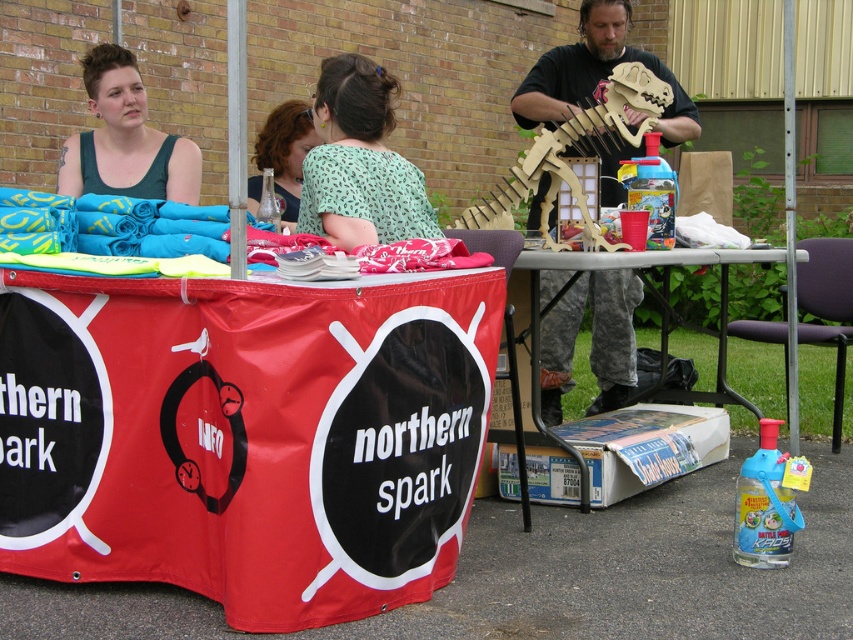
From the picture: You are setting up a booth at an outdoor market and need to place a narrow item between the wooden dinosaur skeleton at right and the metallic silver table at center. Which object should you place it next to to ensure it fits?

The wooden dinosaur skeleton at right is thinner than the metallic silver table at center, so you should place the narrow item next to the wooden dinosaur skeleton at right to ensure it fits.